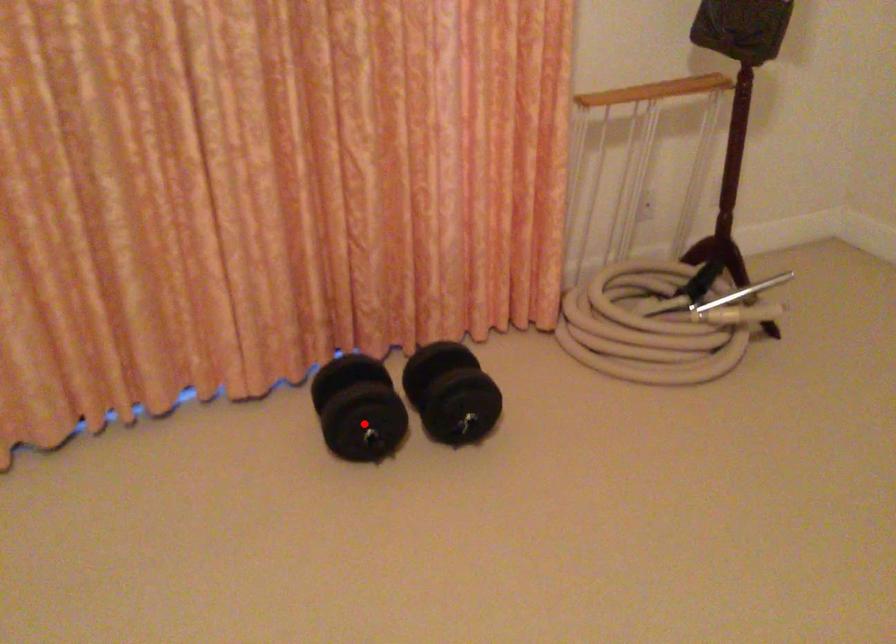
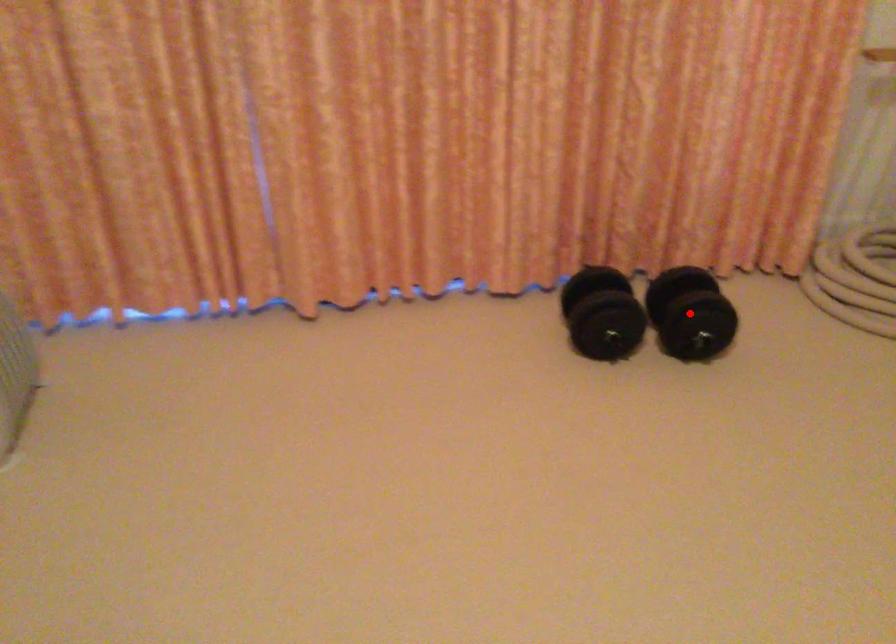
I am providing you with two images of the same scene from different viewpoints. A red point is marked on the first image and another point is marked on the second image. Are the points marked in image1 and image2 representing the same 3D position?

No